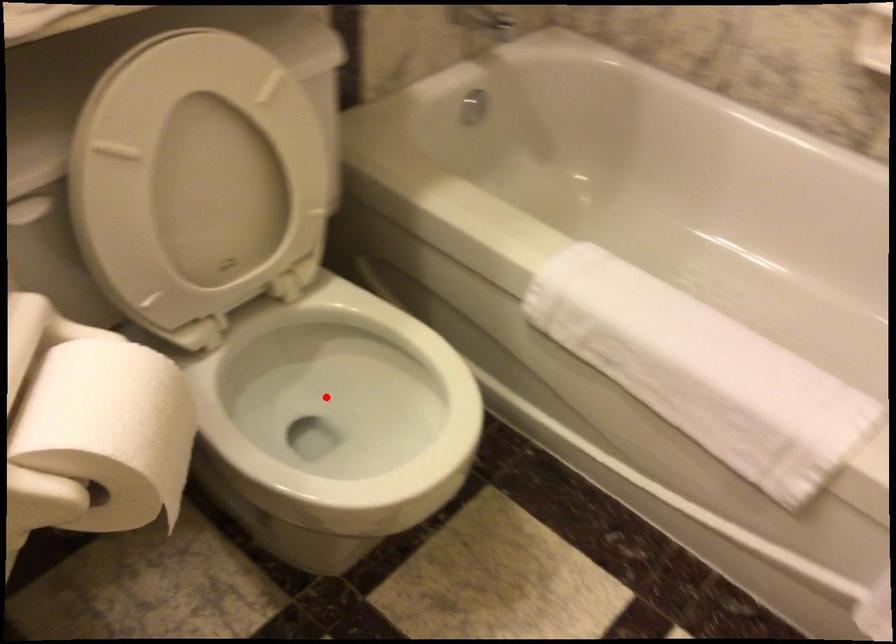
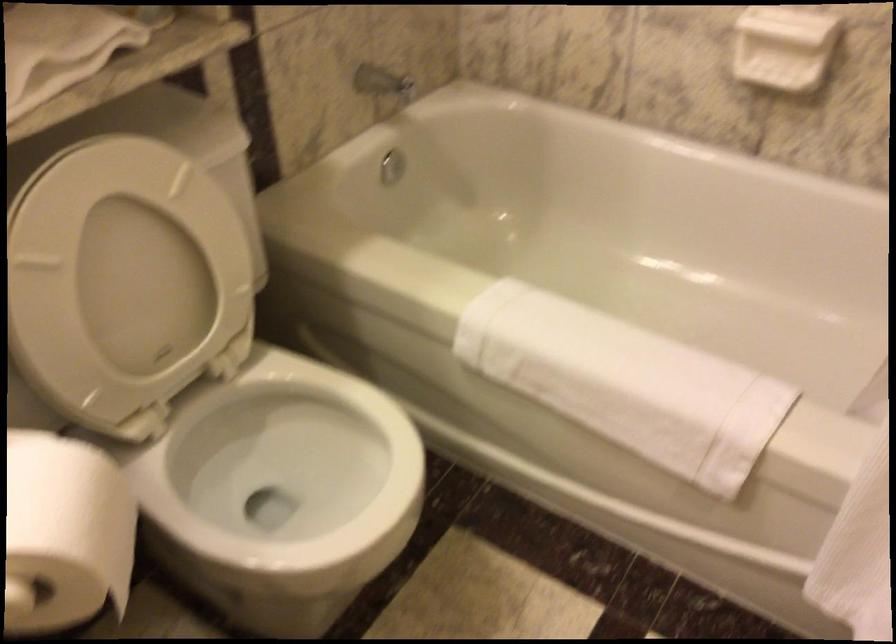
In the second image, find the point that corresponds to the highlighted location in the first image.

(281, 464)